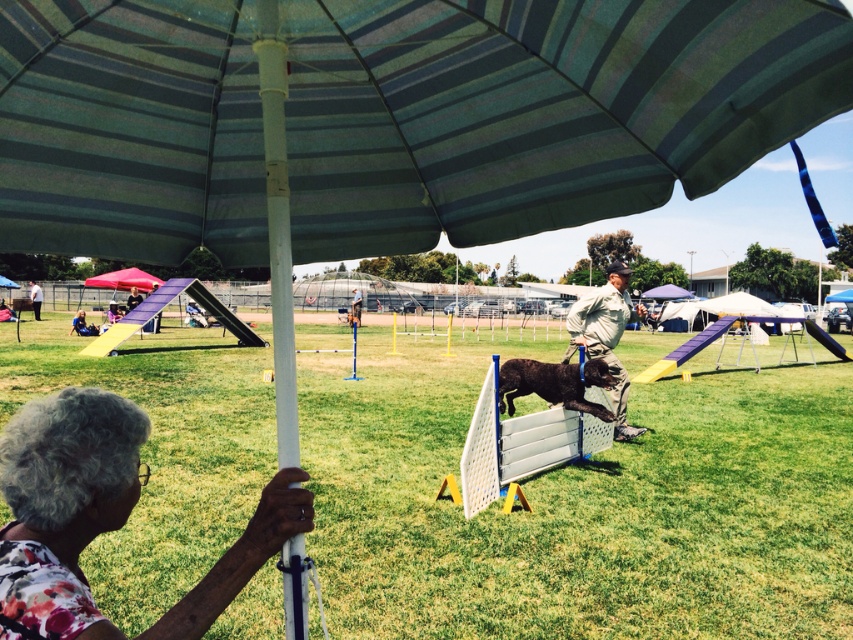
Does white plastic hurdle at center have a greater width compared to shiny brown dog at center?

Correct, the width of white plastic hurdle at center exceeds that of shiny brown dog at center.

Based on the photo, who is higher up, white plastic hurdle at center or shiny brown dog at center?

shiny brown dog at center is higher up.

Is point (564, 440) behind point (585, 362)?

No, (564, 440) is closer to viewer.

Identify the location of white plastic hurdle at center. This screenshot has height=640, width=853. (517, 448).

Is gray hair at lower left positioned at the back of shiny brown dog at center?

No.

Can you confirm if gray hair at lower left is wider than shiny brown dog at center?

No, gray hair at lower left is not wider than shiny brown dog at center.

Does point (39, 545) come in front of point (595, 416)?

Yes.

Find the location of a particular element. gray hair at lower left is located at coordinates (64, 504).

Which is more to the left, gray hair at lower left or khaki uniform at center?

gray hair at lower left is more to the left.

Find the location of `gray hair at lower left`. gray hair at lower left is located at coordinates (64, 504).